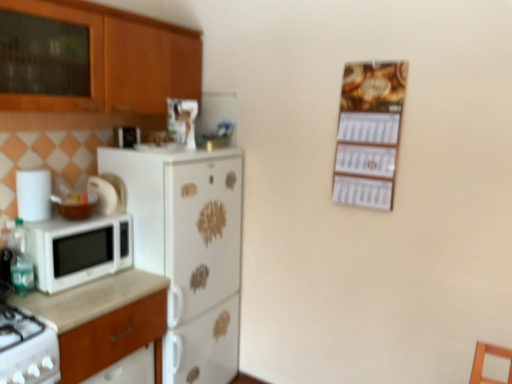
Image resolution: width=512 pixels, height=384 pixels. Describe the element at coordinates (26, 349) in the screenshot. I see `white glossy gas stove at lower left` at that location.

Find the location of a particular element. translucent plastic bottle at left is located at coordinates (21, 261).

The width and height of the screenshot is (512, 384). Find the location of `white matte container at left, which is the 1th appliance from front to back`. white matte container at left, which is the 1th appliance from front to back is located at coordinates (33, 194).

Identify the location of white laminate countertop at left. The image size is (512, 384). (90, 299).

You are a GUI agent. You are given a task and a screenshot of the screen. Output one action in this format:
    pyautogui.click(x=<x>, y=<y>)
    Task: Click on the white glossy toaster at upper left, which appears as the 2th appliance when viewed from the front
    This screenshot has width=512, height=384.
    Given the screenshot: What is the action you would take?
    pos(126,136)

Describe the element at coordinates (189, 250) in the screenshot. I see `white matte refrigerator at center-left` at that location.

The width and height of the screenshot is (512, 384). Find the location of `wooden calendar at upper right`. wooden calendar at upper right is located at coordinates (369, 133).

Considering the relative sizes of wooden calendar at upper right and white matte container at left, the 2th appliance viewed from the top, in the image provided, is wooden calendar at upper right taller than white matte container at left, the 2th appliance viewed from the top,?

Yes, wooden calendar at upper right is taller than white matte container at left, the 2th appliance viewed from the top.

Is wooden calendar at upper right located outside white matte container at left, the 2th appliance viewed from the top?

Yes, wooden calendar at upper right is not within white matte container at left, the 2th appliance viewed from the top.

From the image's perspective, relative to white matte container at left, the 1th appliance positioned from the left, is wooden calendar at upper right above or below?

wooden calendar at upper right is above white matte container at left, the 1th appliance positioned from the left.

Measure the distance from white glossy gas stove at lower left to translucent plastic bottle at left.

They are 32.02 centimeters apart.

Would you consider white glossy gas stove at lower left to be distant from translucent plastic bottle at left?

white glossy gas stove at lower left is near translucent plastic bottle at left, not far away.

Consider the image. In terms of width, does white glossy gas stove at lower left look wider or thinner when compared to translucent plastic bottle at left?

In the image, white glossy gas stove at lower left appears to be wider than translucent plastic bottle at left.

Could you tell me if white glossy gas stove at lower left is facing translucent plastic bottle at left?

No, white glossy gas stove at lower left is not facing towards translucent plastic bottle at left.

Is white laminate countertop at left positioned with its back to wooden calendar at upper right?

No, white laminate countertop at left is not facing the opposite direction of wooden calendar at upper right.

Consider the image. Is white laminate countertop at left next to wooden calendar at upper right?

No, white laminate countertop at left is not next to wooden calendar at upper right.

Considering the positions of objects white laminate countertop at left and wooden calendar at upper right in the image provided, who is more to the left, white laminate countertop at left or wooden calendar at upper right?

white laminate countertop at left is more to the left.

From a real-world perspective, who is located higher, white laminate countertop at left or wooden calendar at upper right?

wooden calendar at upper right.

Would you say white laminate countertop at left is inside or outside white glossy toaster at upper left, the 1th appliance viewed from the right?

white laminate countertop at left is not inside white glossy toaster at upper left, the 1th appliance viewed from the right, it's outside.

Locate an element on the screen. This screenshot has height=384, width=512. countertop that appears below the white glossy toaster at upper left, the first appliance in the top-to-bottom sequence (from a real-world perspective) is located at coordinates point(90,299).

Considering the positions of objects white laminate countertop at left and white glossy toaster at upper left, which appears as the first appliance when viewed from the back, in the image provided, who is behind, white laminate countertop at left or white glossy toaster at upper left, which appears as the first appliance when viewed from the back,?

white glossy toaster at upper left, which appears as the first appliance when viewed from the back.

Is white matte container at left, the 2th appliance in the back-to-front sequence, not near translucent plastic bottle at left?

white matte container at left, the 2th appliance in the back-to-front sequence, is near translucent plastic bottle at left, not far away.

Looking at this image, does white matte container at left, the first appliance when ordered from bottom to top, turn towards translucent plastic bottle at left?

No, white matte container at left, the first appliance when ordered from bottom to top, is not turned towards translucent plastic bottle at left.

Is point (26, 211) closer or farther from the camera than point (15, 291)?

Point (26, 211) is positioned farther from the camera compared to point (15, 291).

What are the coordinates of `appliance located on the left of translucent plastic bottle at left` in the screenshot? It's located at (33, 194).

Can white laminate countertop at left be found inside wooden calendar at upper right?

No.

From the picture: Is wooden calendar at upper right not close to white laminate countertop at left?

wooden calendar at upper right is far away from white laminate countertop at left.

Between wooden calendar at upper right and white laminate countertop at left, which one appears on the right side from the viewer's perspective?

From the viewer's perspective, wooden calendar at upper right appears more on the right side.

Identify the location of countertop below the wooden calendar at upper right (from a real-world perspective). (90, 299).

Is white matte refrigerator at center-left completely or partially inside wooden calendar at upper right?

No, white matte refrigerator at center-left is not surrounded by wooden calendar at upper right.

Considering the relative sizes of wooden calendar at upper right and white matte refrigerator at center-left in the image provided, is wooden calendar at upper right shorter than white matte refrigerator at center-left?

Indeed, wooden calendar at upper right has a lesser height compared to white matte refrigerator at center-left.

Is wooden calendar at upper right further to camera compared to white matte refrigerator at center-left?

No, wooden calendar at upper right is closer to the viewer.

Does point (350, 120) come closer to viewer compared to point (217, 366)?

Yes, it is.

Identify the location of appliance below the wooden calendar at upper right (from the image's perspective). The image size is (512, 384). (33, 194).

Find the location of `bottle that appears on the left of white glossy gas stove at lower left`. bottle that appears on the left of white glossy gas stove at lower left is located at coordinates (21, 261).

Looking at the image, which one is located closer to white matte microwave at left, wooden cabinet at upper left or white glossy gas stove at lower left?

white glossy gas stove at lower left is positioned closer to the anchor white matte microwave at left.

Estimate the real-world distances between objects in this image. Which object is closer to white matte container at left, which ranks as the 2th appliance in right-to-left order, white matte microwave at left or white glossy toaster at upper left, which ranks as the second appliance in left-to-right order?

white matte microwave at left is closer to white matte container at left, which ranks as the 2th appliance in right-to-left order.

Which object lies further to the anchor point translucent plastic bottle at left, white matte refrigerator at center-left or white matte container at left, the 2th appliance in the back-to-front sequence?

Based on the image, white matte refrigerator at center-left appears to be further to translucent plastic bottle at left.

Based on their spatial positions, is white matte microwave at left or white laminate countertop at left further from white glossy toaster at upper left, which ranks as the second appliance in left-to-right order?

Based on the image, white laminate countertop at left appears to be further to white glossy toaster at upper left, which ranks as the second appliance in left-to-right order.

Consider the image. Estimate the real-world distances between objects in this image. Which object is further from white matte microwave at left, translucent plastic bottle at left or white matte refrigerator at center-left?

white matte refrigerator at center-left.

When comparing their distances from white matte container at left, the 2th appliance viewed from the top, does translucent plastic bottle at left or wooden calendar at upper right seem closer?

translucent plastic bottle at left is closer to white matte container at left, the 2th appliance viewed from the top.

Based on their spatial positions, is white laminate countertop at left or white matte microwave at left closer to wooden calendar at upper right?

The object closer to wooden calendar at upper right is white laminate countertop at left.

Estimate the real-world distances between objects in this image. Which object is further from white glossy toaster at upper left, which ranks as the 2th appliance in bottom-to-top order, white matte container at left, the 2th appliance viewed from the top, or wooden cabinet at upper left?

white matte container at left, the 2th appliance viewed from the top.

This screenshot has width=512, height=384. What are the coordinates of `appliance between white glossy toaster at upper left, which appears as the first appliance when viewed from the back, and white matte refrigerator at center-left in the up-down direction` in the screenshot? It's located at (33, 194).

Find the location of a particular element. The height and width of the screenshot is (384, 512). countertop positioned between white glossy gas stove at lower left and white matte refrigerator at center-left from near to far is located at coordinates (90, 299).

Where is `refrigerator between wooden cabinet at upper left and wooden calendar at upper right in the horizontal direction`? refrigerator between wooden cabinet at upper left and wooden calendar at upper right in the horizontal direction is located at coordinates (189, 250).

Locate an element on the screen. appliance that lies between white glossy toaster at upper left, the 1th appliance viewed from the right, and white laminate countertop at left from top to bottom is located at coordinates (33, 194).